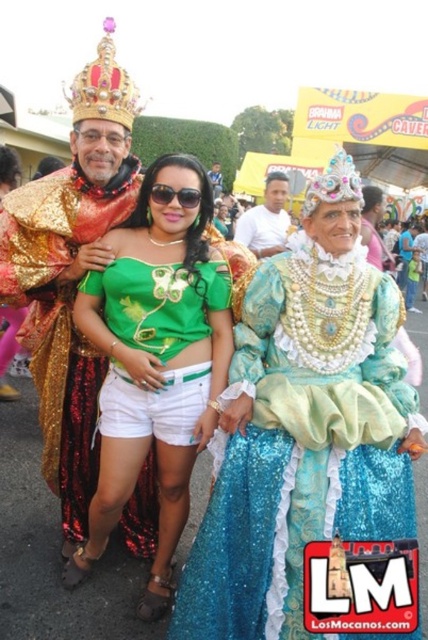
Question: In this image, where is goldmetalliccrown at upper left located relative to sunglasses at center?

Choices:
 (A) right
 (B) left

Answer: (B)

Question: Which point is closer to the camera?

Choices:
 (A) shiny gold crown at upper left
 (B) sequined gold robe at left
 (C) green satin blouse at center

Answer: (C)

Question: Considering the relative positions of goldmetalliccrown at upper left and sparkly silver crown at upper center in the image provided, where is goldmetalliccrown at upper left located with respect to sparkly silver crown at upper center?

Choices:
 (A) above
 (B) below

Answer: (A)

Question: Is white cotton shirt at center bigger than sparkly silver crown at upper center?

Choices:
 (A) no
 (B) yes

Answer: (A)

Question: Which point is closer to the camera?

Choices:
 (A) shiny gold crown at upper left
 (B) green satin blouse at center
 (C) sequined gold robe at left
 (D) goldmetalliccrown at upper left

Answer: (B)

Question: Considering the real-world distances, which object is farthest from the green satin blouse at center?

Choices:
 (A) sunglasses at center
 (B) shiny blue fabric dress at center
 (C) shiny gold crown at upper left

Answer: (C)